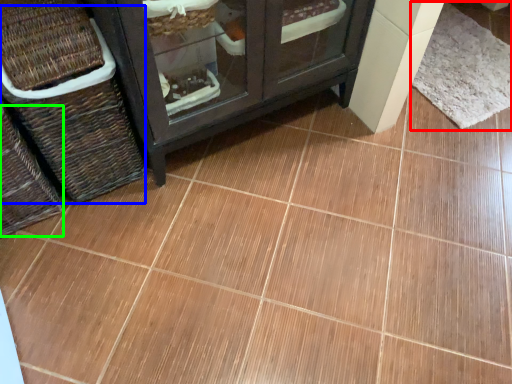
Question: Estimate the real-world distances between objects in this image. Which object is closer to mat (highlighted by a red box), basket (highlighted by a blue box) or basket (highlighted by a green box)?

Choices:
 (A) basket
 (B) basket

Answer: (A)